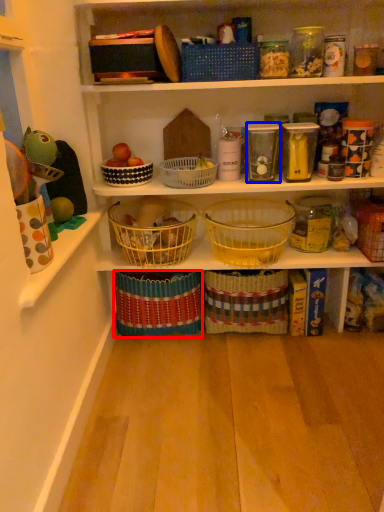
Question: Which object appears closest to the camera in this image, basket (highlighted by a red box) or glass jar (highlighted by a blue box)?

Choices:
 (A) basket
 (B) glass jar

Answer: (B)